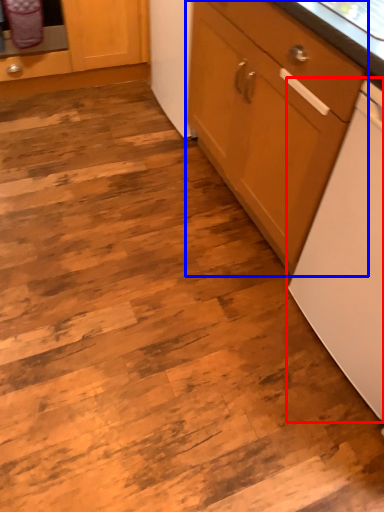
Question: Which object is further to the camera taking this photo, home appliance (highlighted by a red box) or cabinetry (highlighted by a blue box)?

Choices:
 (A) home appliance
 (B) cabinetry

Answer: (B)